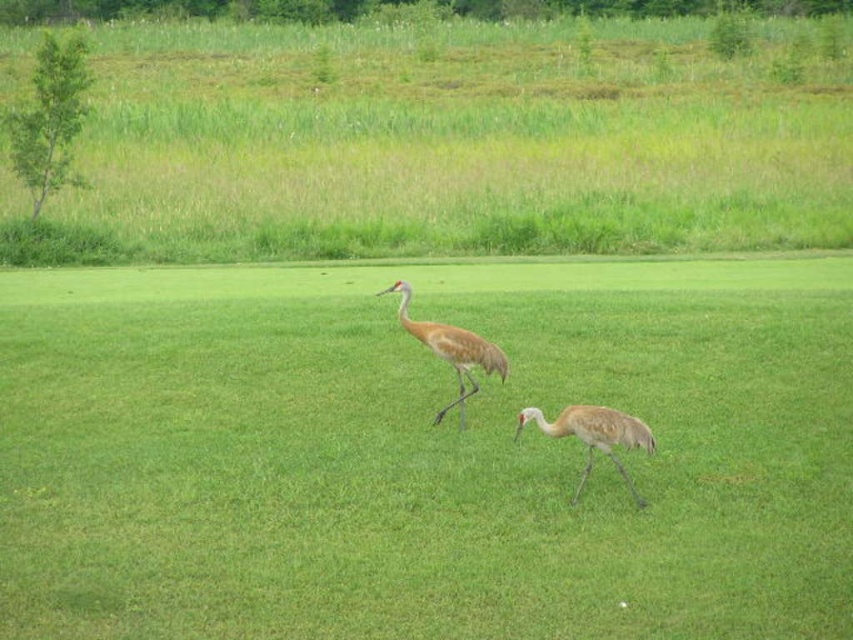
You are standing at the point labeled as point (x=463, y=140) in the image. What do you see in the direction of the upper left?

You see green grass at upper left in the direction of the upper left from point (x=463, y=140).

You are a photographer aiming to capture the brown feathered crane at center while ensuring the green grass at center is visible in the background. Based on their positions, can you confirm if the crane is positioned in front of the grass?

The green grass at center is in front of the brown feathered crane at center, so the crane would actually be behind the grass in the photo.

You are a photographer aiming to capture a clear shot of the light brown feathered bird at center. However, there is green grass at upper left in the way. Can you adjust your position to ensure the bird is fully visible without obstruction?

The light brown feathered bird at center is behind the green grass at upper left, so moving your camera position slightly to the right or left might help you position the bird in front of the grass for a clear shot.